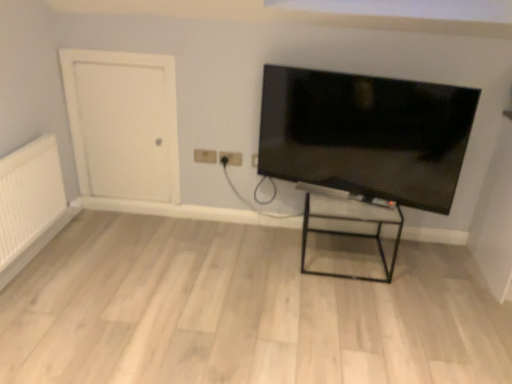
Question: In terms of size, does white textured radiator at left appear bigger or smaller than beige plastic electric outlet at center, which appears as the 2th electric outlet when viewed from the right?

Choices:
 (A) small
 (B) big

Answer: (B)

Question: From the image's perspective, is white textured radiator at left positioned above or below beige plastic electric outlet at center, which appears as the 2th electric outlet when viewed from the right?

Choices:
 (A) above
 (B) below

Answer: (B)

Question: Which of these objects is positioned farthest from the matte plastic outlet at upper center, the 2th electric outlet viewed from the left?

Choices:
 (A) white matte door at left
 (B) transparent glass table at center
 (C) black glossy tv at upper right
 (D) beige plastic electric outlet at center, placed as the first electric outlet when sorted from left to right
 (E) white textured radiator at left

Answer: (E)

Question: Considering the real-world distances, which object is farthest from the black glossy tv at upper right?

Choices:
 (A) white matte door at left
 (B) transparent glass table at center
 (C) white textured radiator at left
 (D) beige plastic electric outlet at center, which appears as the 2th electric outlet when viewed from the right
 (E) matte plastic outlet at upper center, the 1th electric outlet when ordered from right to left

Answer: (C)